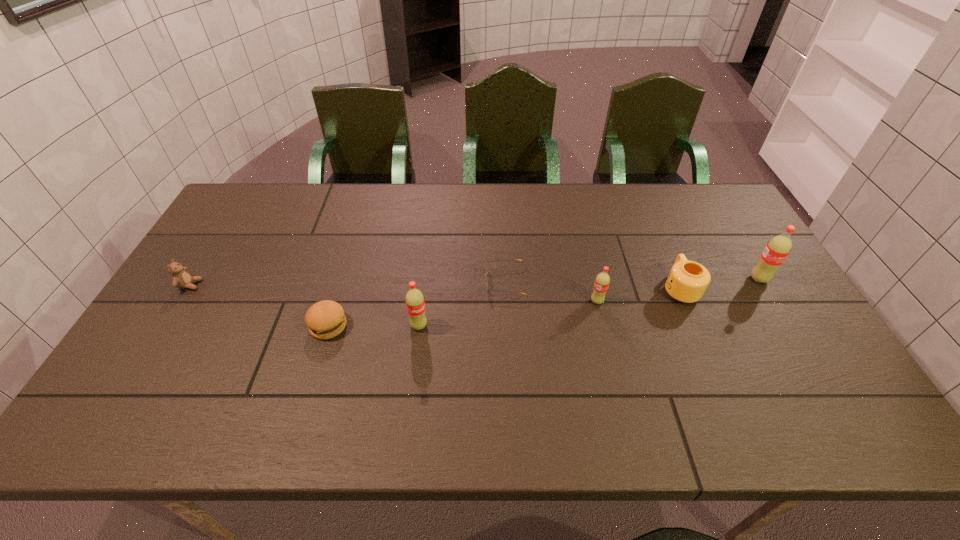
At what (x,y) coordinates should I click in order to perform the action: click on vacant space in between the second object from right to left and the teddy bear. Please return your answer as a coordinate pair (x, y). Looking at the image, I should click on (435, 287).

I want to click on free spot between the teddy bear and the third object from right to left, so click(x=394, y=293).

This screenshot has width=960, height=540. I want to click on free space between the second object from right to left and the second farthest soda, so click(x=638, y=295).

Where is `blank region between the farthest soda and the teddy bear`? blank region between the farthest soda and the teddy bear is located at coordinates (474, 282).

Locate an element on the screen. free space between the fourth object from right to left and the leftmost object is located at coordinates (348, 284).

At what (x,y) coordinates should I click in order to perform the action: click on vacant space that is in between the second shortest soda and the second object from left to right. Please return your answer as a coordinate pair (x, y). Looking at the image, I should click on (373, 326).

The image size is (960, 540). In order to click on free space that is in between the leftmost object and the spectacles in this screenshot , I will do tap(348, 284).

The image size is (960, 540). What are the coordinates of `empty space that is in between the second object from right to left and the spectacles` in the screenshot? It's located at (592, 285).

Image resolution: width=960 pixels, height=540 pixels. Find the location of `object that is the closest to the sixth tallest object`. object that is the closest to the sixth tallest object is located at coordinates click(x=415, y=304).

Find the location of a particular element. This screenshot has width=960, height=540. object that ranks as the fifth closest to the spectacles is located at coordinates (777, 249).